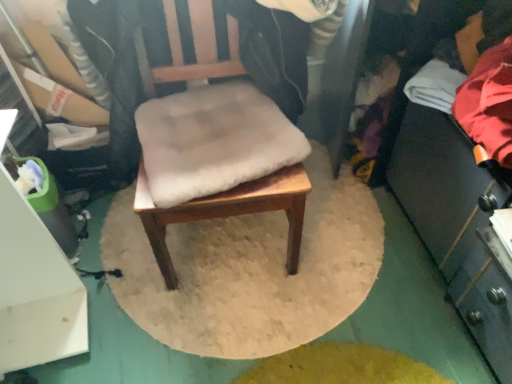
Question: Can you confirm if red fabric at right is positioned to the right of white soft cushion at center?

Choices:
 (A) no
 (B) yes

Answer: (B)

Question: Considering the relative sizes of red fabric at right and white soft cushion at center in the image provided, is red fabric at right smaller than white soft cushion at center?

Choices:
 (A) yes
 (B) no

Answer: (B)

Question: From the image's perspective, is red fabric at right under white soft cushion at center?

Choices:
 (A) yes
 (B) no

Answer: (B)

Question: Considering the relative sizes of red fabric at right and white soft cushion at center in the image provided, is red fabric at right bigger than white soft cushion at center?

Choices:
 (A) yes
 (B) no

Answer: (A)

Question: Could you tell me if red fabric at right is turned towards white soft cushion at center?

Choices:
 (A) no
 (B) yes

Answer: (B)

Question: Relative to white soft cushion at center, is wooden chair at center in front or behind?

Choices:
 (A) front
 (B) behind

Answer: (A)

Question: In terms of width, does wooden chair at center look wider or thinner when compared to white soft cushion at center?

Choices:
 (A) wide
 (B) thin

Answer: (A)

Question: From the image's perspective, relative to white soft cushion at center, is wooden chair at center above or below?

Choices:
 (A) below
 (B) above

Answer: (B)

Question: Is point (288, 225) positioned closer to the camera than point (160, 104)?

Choices:
 (A) farther
 (B) closer

Answer: (A)

Question: Is wooden chair at center wider or thinner than red fabric at right?

Choices:
 (A) thin
 (B) wide

Answer: (B)

Question: In the image, is wooden chair at center on the left side or the right side of red fabric at right?

Choices:
 (A) right
 (B) left

Answer: (B)

Question: In terms of height, does wooden chair at center look taller or shorter compared to red fabric at right?

Choices:
 (A) short
 (B) tall

Answer: (B)

Question: From a real-world perspective, is wooden chair at center physically located above or below red fabric at right?

Choices:
 (A) above
 (B) below

Answer: (B)

Question: Looking at their shapes, would you say red fabric at right is wider or thinner than wooden chair at center?

Choices:
 (A) thin
 (B) wide

Answer: (A)

Question: Considering the positions of point (466, 92) and point (291, 221), is point (466, 92) closer or farther from the camera than point (291, 221)?

Choices:
 (A) closer
 (B) farther

Answer: (A)